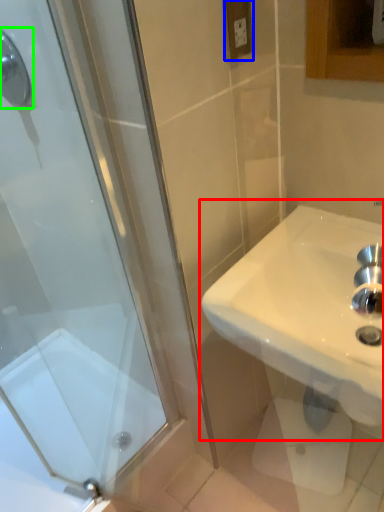
Question: Estimate the real-world distances between objects in this image. Which object is farther from sink (highlighted by a red box), electric outlet (highlighted by a blue box) or shower (highlighted by a green box)?

Choices:
 (A) electric outlet
 (B) shower

Answer: (B)